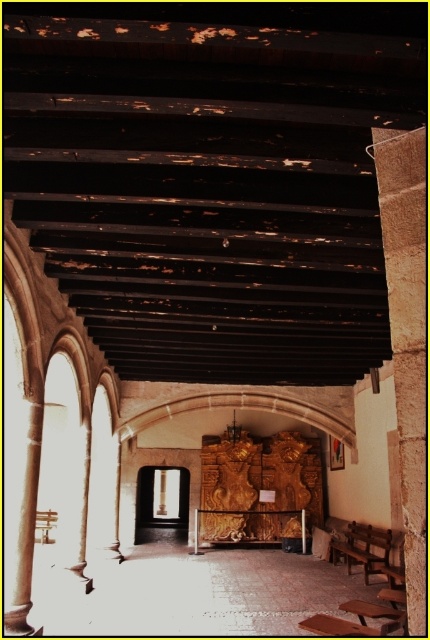
Does brown stone pillar at right appear on the right side of wooden bench at lower right?

No, brown stone pillar at right is not to the right of wooden bench at lower right.

Is point (386, 188) behind point (355, 561)?

No, it is in front of (355, 561).

Image resolution: width=430 pixels, height=640 pixels. I want to click on brown stone pillar at right, so click(x=407, y=333).

Which of these two, wooden bench at center or wooden bench at lower right, stands taller?

Standing taller between the two is wooden bench at lower right.

Is the position of wooden bench at center more distant than that of wooden bench at lower right?

No, wooden bench at center is in front of wooden bench at lower right.

Is point (334, 627) less distant than point (374, 563)?

Yes, it is.

The image size is (430, 640). Find the location of `wooden bench at center`. wooden bench at center is located at coordinates (362, 616).

Which is more to the right, brown stone pillar at right or wooden bench at center?

From the viewer's perspective, wooden bench at center appears more on the right side.

In the scene shown: Which of these two, brown stone pillar at right or wooden bench at center, stands shorter?

wooden bench at center is shorter.

At what (x,y) coordinates should I click in order to perform the action: click on brown stone pillar at right. Please return your answer as a coordinate pair (x, y). The height and width of the screenshot is (640, 430). Looking at the image, I should click on (407, 333).